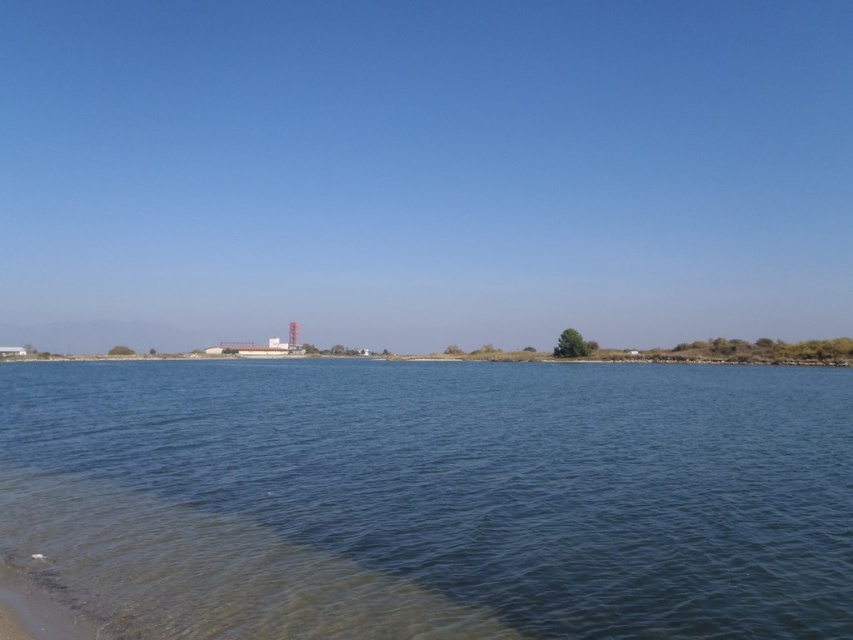
You are standing at the point marked by the coordinate point at (434, 499) in the image. Based on the scene description, what would you see directly below you?

The point at (434, 499) indicates blue water at center, so you would see blue water directly below you.

You are standing at the sandy beach at lower left and want to reach the blue water at center. Which direction should you walk to get there?

The blue water at center is positioned on the right side of sandy beach at lower left, so you should walk towards the right to reach it.